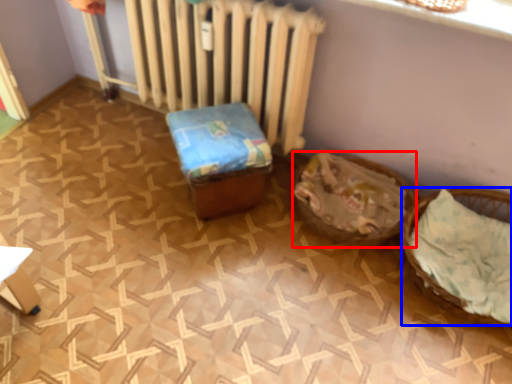
Question: Which of the following is the closest to the observer, basket (highlighted by a red box) or basket (highlighted by a blue box)?

Choices:
 (A) basket
 (B) basket

Answer: (B)